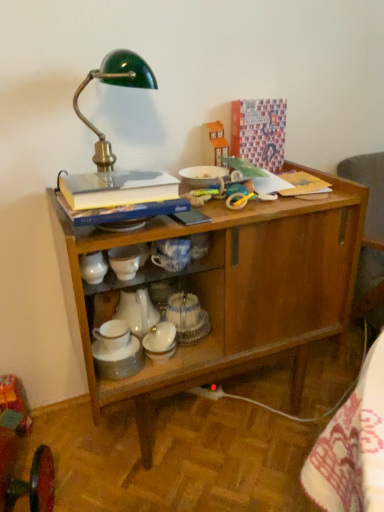
Find the location of `blank area beneath wooden cabinet at center (from a real-world perspective)`. blank area beneath wooden cabinet at center (from a real-world perspective) is located at coordinates (220, 414).